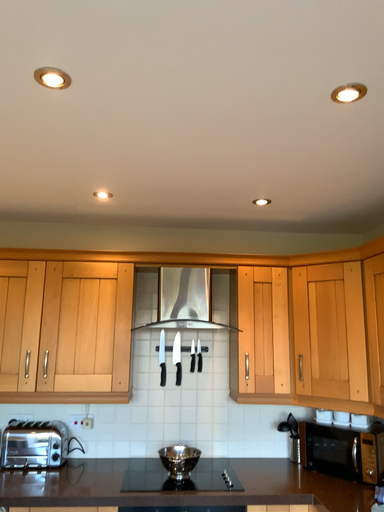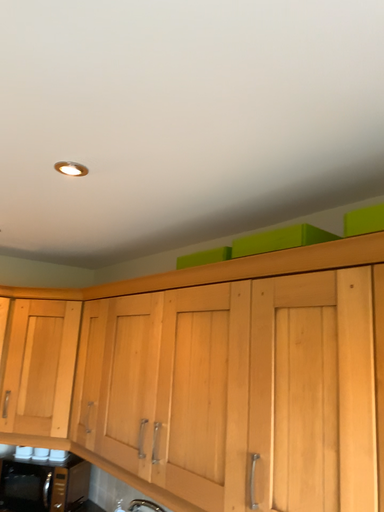
Question: Which way did the camera rotate in the video?

Choices:
 (A) rotated right
 (B) rotated left

Answer: (A)